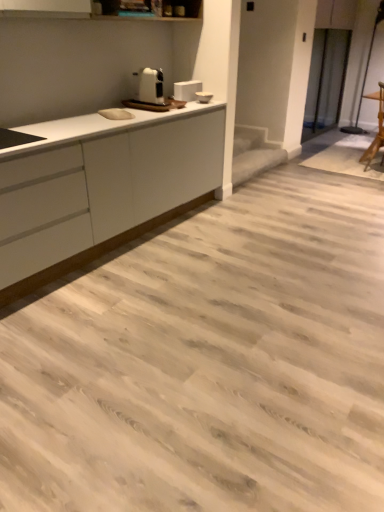
Question: Should I look upward or downward to see white glossy toaster at upper center?

Choices:
 (A) down
 (B) up

Answer: (B)

Question: From the image's perspective, does white glossy toaster at upper center appear lower than wooden chair at right?

Choices:
 (A) no
 (B) yes

Answer: (A)

Question: From a real-world perspective, is white glossy toaster at upper center on top of wooden chair at right?

Choices:
 (A) yes
 (B) no

Answer: (A)

Question: Is white glossy toaster at upper center in front of wooden chair at right?

Choices:
 (A) no
 (B) yes

Answer: (B)

Question: Is white glossy toaster at upper center positioned far away from wooden chair at right?

Choices:
 (A) no
 (B) yes

Answer: (B)

Question: From a real-world perspective, is white glossy toaster at upper center located beneath wooden chair at right?

Choices:
 (A) no
 (B) yes

Answer: (A)

Question: Is white glossy toaster at upper center facing towards wooden chair at right?

Choices:
 (A) no
 (B) yes

Answer: (A)

Question: Can you confirm if white matte countertop at left is positioned to the left of white plastic toaster at upper center?

Choices:
 (A) yes
 (B) no

Answer: (A)

Question: Can you confirm if white matte countertop at left is shorter than white plastic toaster at upper center?

Choices:
 (A) yes
 (B) no

Answer: (B)

Question: Does white matte countertop at left have a larger size compared to white plastic toaster at upper center?

Choices:
 (A) yes
 (B) no

Answer: (A)

Question: From a real-world perspective, is white matte countertop at left positioned under white plastic toaster at upper center based on gravity?

Choices:
 (A) no
 (B) yes

Answer: (B)

Question: Is there a large distance between white matte countertop at left and white plastic toaster at upper center?

Choices:
 (A) yes
 (B) no

Answer: (B)

Question: Could you tell me if white matte countertop at left is facing white plastic toaster at upper center?

Choices:
 (A) yes
 (B) no

Answer: (B)

Question: From a real-world perspective, is white plastic toaster at upper center on top of white matte countertop at left?

Choices:
 (A) yes
 (B) no

Answer: (A)